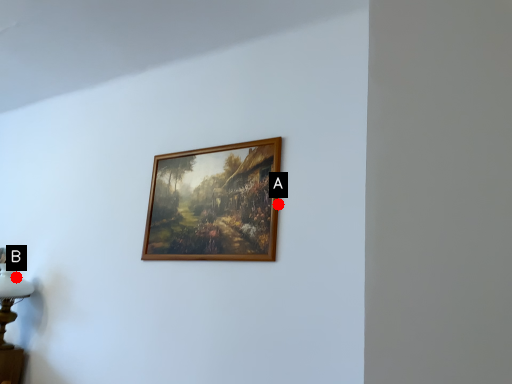
Question: Two points are circled on the image, labeled by A and B beside each circle. Which point is closer to the camera?

Choices:
 (A) A is closer
 (B) B is closer

Answer: (A)